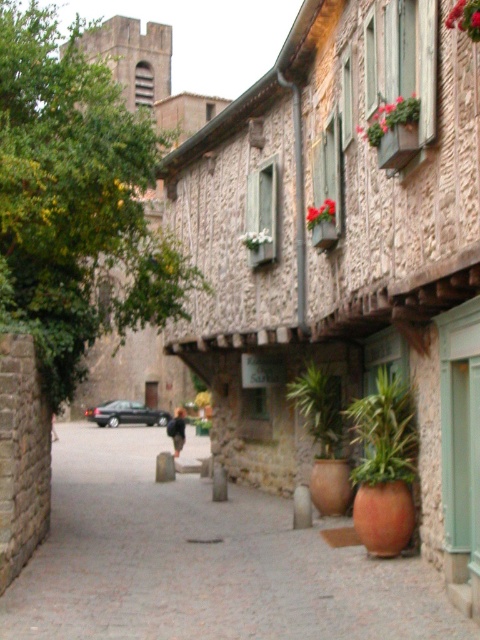
Is paved stone walkway at center above green leafy plant at lower center?

No, paved stone walkway at center is not above green leafy plant at lower center.

Which is above, paved stone walkway at center or green leafy plant at lower center?

green leafy plant at lower center is above.

At what (x,y) coordinates should I click in order to perform the action: click on paved stone walkway at center. Please return your answer as a coordinate pair (x, y). Looking at the image, I should click on (202, 561).

Image resolution: width=480 pixels, height=640 pixels. I want to click on paved stone walkway at center, so click(x=202, y=561).

Does paved stone walkway at center appear on the right side of green leafy plant at center-right?

No, paved stone walkway at center is not to the right of green leafy plant at center-right.

Between paved stone walkway at center and green leafy plant at center-right, which one has more height?

paved stone walkway at center

Which is in front, point (129, 548) or point (383, 429)?

Point (383, 429) is in front.

The height and width of the screenshot is (640, 480). Find the location of `paved stone walkway at center`. paved stone walkway at center is located at coordinates (202, 561).

From the picture: Can you confirm if green textured plant at upper right is thinner than green textured planter at center?

Indeed, green textured plant at upper right has a lesser width compared to green textured planter at center.

Is green textured plant at upper right in front of green textured planter at center?

Yes.

Where is `green textured plant at upper right`? The height and width of the screenshot is (640, 480). green textured plant at upper right is located at coordinates (466, 17).

Identify the location of green textured plant at upper right. (466, 17).